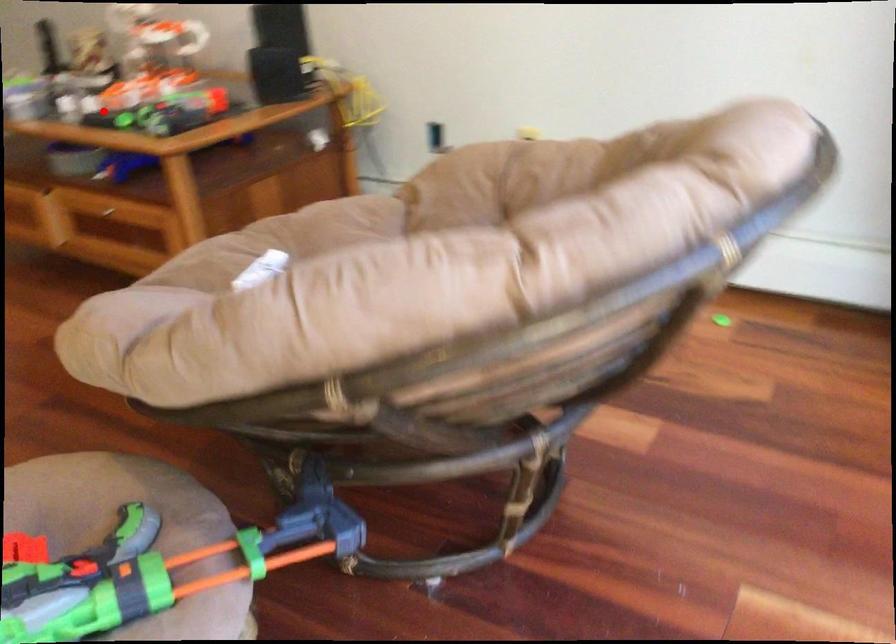
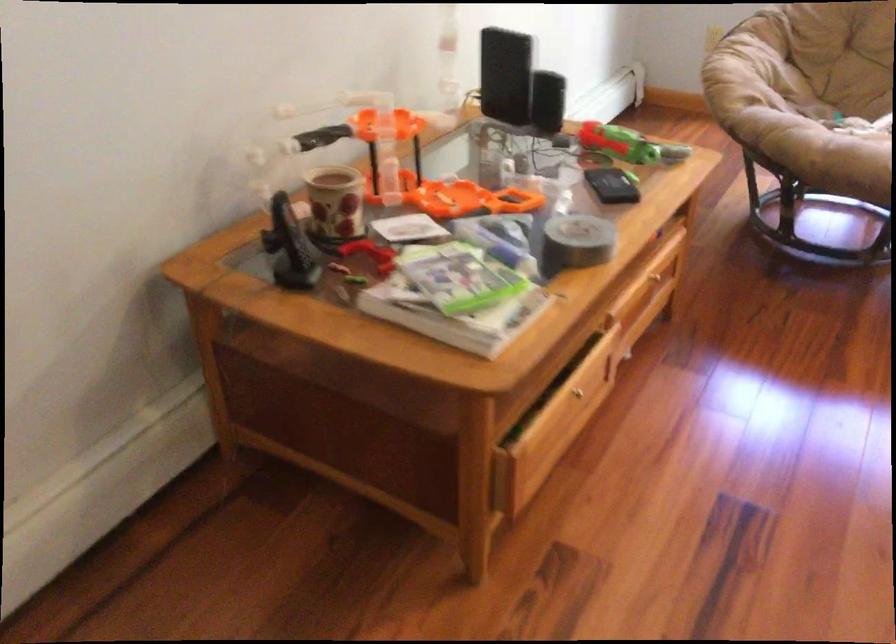
Where in the second image is the point corresponding to the highlighted location from the first image?

(613, 185)